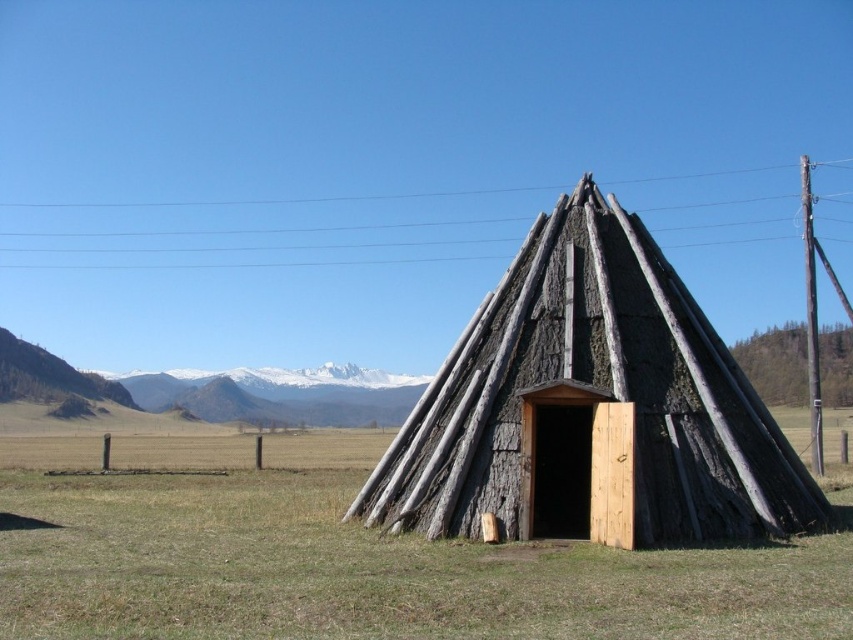
Between green grass at center and white snow-covered mountain at upper center, which one has less height?

green grass at center is shorter.

Between point (482, 570) and point (395, 412), which one is positioned in front?

Point (482, 570) is in front.

Locate an element on the screen. The width and height of the screenshot is (853, 640). green grass at center is located at coordinates (355, 557).

Based on the photo, can you confirm if charred wood hut at center is positioned below white snow-covered mountain at upper center?

Actually, charred wood hut at center is above white snow-covered mountain at upper center.

How distant is charred wood hut at center from white snow-covered mountain at upper center?

charred wood hut at center and white snow-covered mountain at upper center are 69.78 meters apart from each other.

Image resolution: width=853 pixels, height=640 pixels. I want to click on charred wood hut at center, so click(590, 408).

Can you confirm if green grass at center is smaller than charred wood hut at center?

No, green grass at center is not smaller than charred wood hut at center.

The height and width of the screenshot is (640, 853). What do you see at coordinates (355, 557) in the screenshot?
I see `green grass at center` at bounding box center [355, 557].

Image resolution: width=853 pixels, height=640 pixels. What are the coordinates of `green grass at center` in the screenshot? It's located at (355, 557).